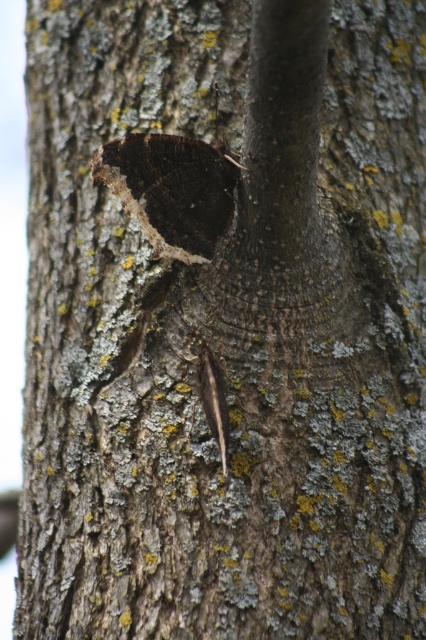
Question: Considering the relative positions of dark matte butterfly at center and brown fuzzy caterpillar at center in the image provided, where is dark matte butterfly at center located with respect to brown fuzzy caterpillar at center?

Choices:
 (A) below
 (B) above

Answer: (B)

Question: Among these objects, which one is nearest to the camera?

Choices:
 (A) brown fuzzy caterpillar at center
 (B) dark matte butterfly at center

Answer: (B)

Question: Does dark matte butterfly at center have a greater width compared to brown fuzzy caterpillar at center?

Choices:
 (A) yes
 (B) no

Answer: (A)

Question: Which point is farther to the camera?

Choices:
 (A) dark matte butterfly at center
 (B) brown fuzzy caterpillar at center

Answer: (B)

Question: Does dark matte butterfly at center appear on the right side of brown fuzzy caterpillar at center?

Choices:
 (A) yes
 (B) no

Answer: (B)